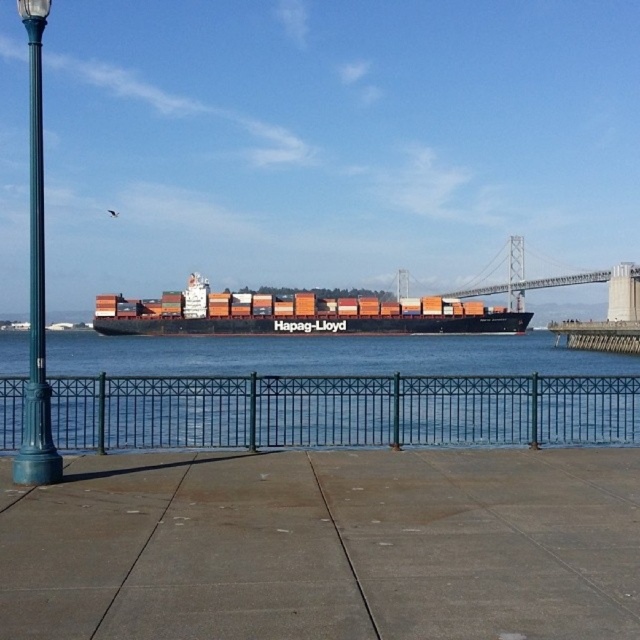
You are standing at the point marked by the coordinates (324, 547) in the image. Looking around, you see the dark green metal railing on the left and the Hapag Lloyd cargo ship in the middle ground. Which direction should you walk to reach the dark green metal railing?

Since the dark green metal railing is on the left side of the frame and the point (324, 547) is at the center, you should walk to your left to reach the dark green metal railing.

You are a delivery person trying to park your 2.5 meter wide delivery van on the concrete at center. The green metal fence at center is blocking part of the parking space. Can you fit your van there?

The concrete at center has a larger width than the green metal fence at center, so there is enough space for the delivery van. The van can be parked there as the concrete area is wider than the fence obstruction.